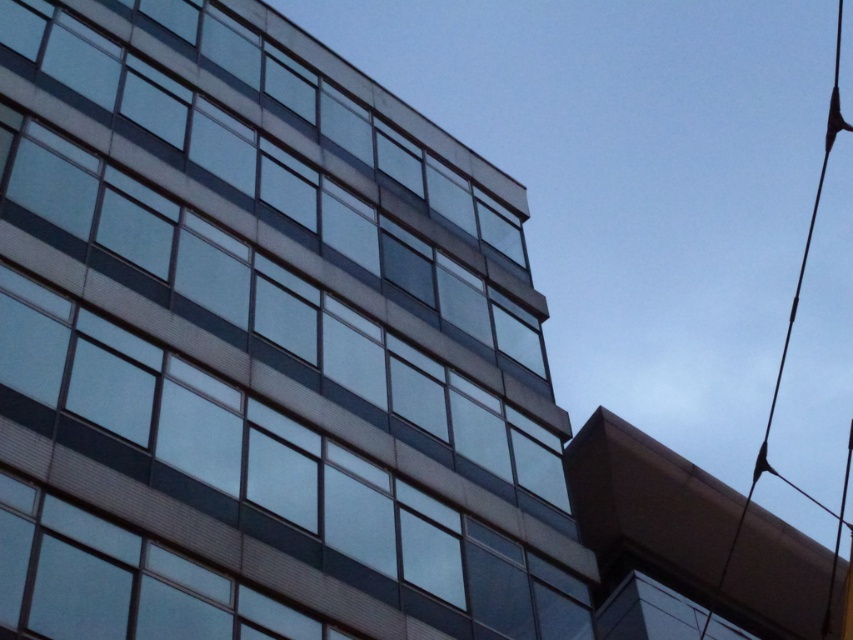
Is transparent glass windows at center taller than black wire at upper right?

Incorrect, transparent glass windows at center's height is not larger of black wire at upper right's.

Between transparent glass windows at center and black wire at upper right, which one has more height?

black wire at upper right

Describe the element at coordinates (260, 346) in the screenshot. The height and width of the screenshot is (640, 853). I see `transparent glass windows at center` at that location.

Locate an element on the screen. The height and width of the screenshot is (640, 853). transparent glass windows at center is located at coordinates (260, 346).